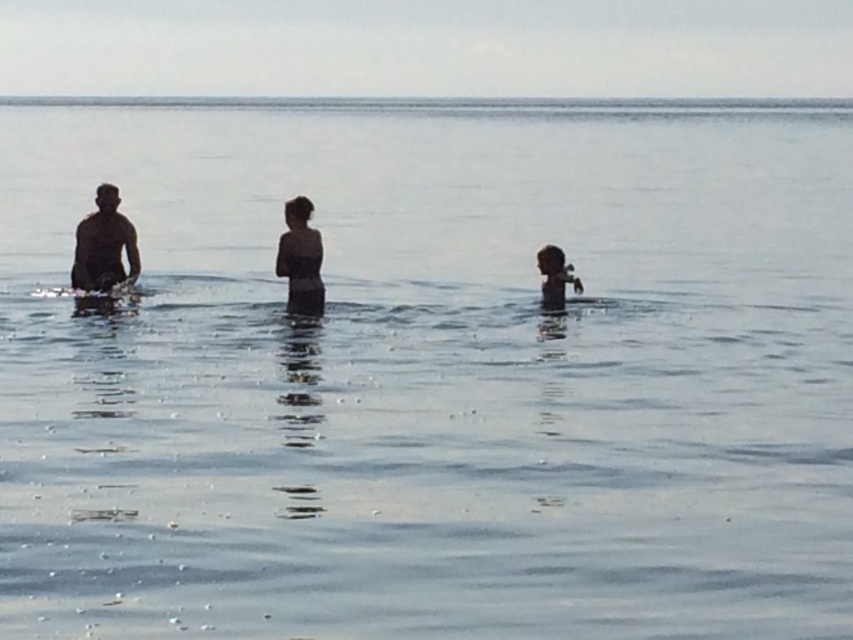
Is smooth skin child at center above smooth skin child at right?

Yes.

Who is more forward, [315,257] or [538,252]?

Point [315,257] is in front.

Which is in front, point (306, 218) or point (544, 282)?

Positioned in front is point (306, 218).

Find the location of `smooth skin child at center`. smooth skin child at center is located at coordinates (300, 259).

Which is behind, point (115, 220) or point (552, 298)?

The point (115, 220) is behind.

Is dark skin human at left wider than smooth skin child at right?

Correct, the width of dark skin human at left exceeds that of smooth skin child at right.

Is point (82, 253) closer to viewer compared to point (561, 252)?

No.

In order to click on dark skin human at left in this screenshot , I will do `click(103, 244)`.

Between dark skin human at left and smooth skin child at center, which one has less height?

Standing shorter between the two is dark skin human at left.

Is dark skin human at left above smooth skin child at center?

Correct, dark skin human at left is located above smooth skin child at center.

Which is in front, point (115, 241) or point (296, 236)?

Positioned in front is point (296, 236).

Image resolution: width=853 pixels, height=640 pixels. Identify the location of dark skin human at left. (103, 244).